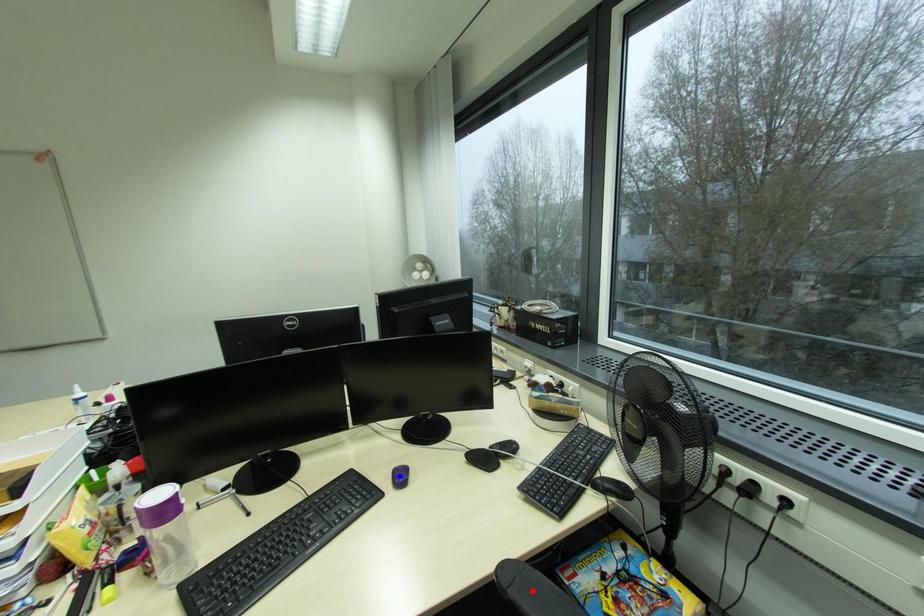
Question: Two points are marked on the image. Which point is closer to the camera?

Choices:
 (A) Blue point is closer.
 (B) Red point is closer.

Answer: (B)